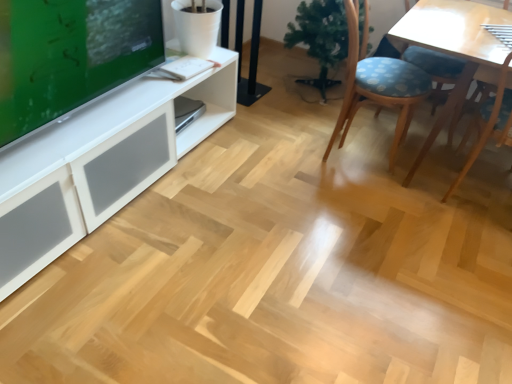
I want to click on vacant space to the left of green matte artificial plant at center, so [269, 90].